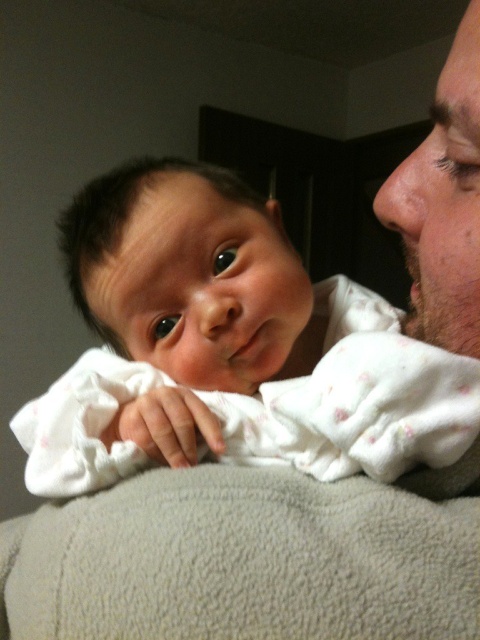
You are holding a baby and want to hand them to someone standing next to you. The point where you need to hand over the baby is at point (139,195). Can you reach that point if your arm can extend 20 inches?

The point (139,195) is 19.74 inches away from you, so yes, you can reach it since your arm can extend 20 inches.

You are standing in the room and see two points marked in the image. The first point is at coordinate point(354, 464) and the second is at point(462, 140). From your perspective, which point is closer to you?

Point(462, 140) is closer to you because it is in front of point(354, 464) according to their spatial arrangement.

You are a photographer taking a picture of the white soft fabric baby at center and the bearded man at right. Based on their sizes in the image, which one is closer to the camera?

The white soft fabric baby at center is closer to the camera because it appears larger than the bearded man at right.